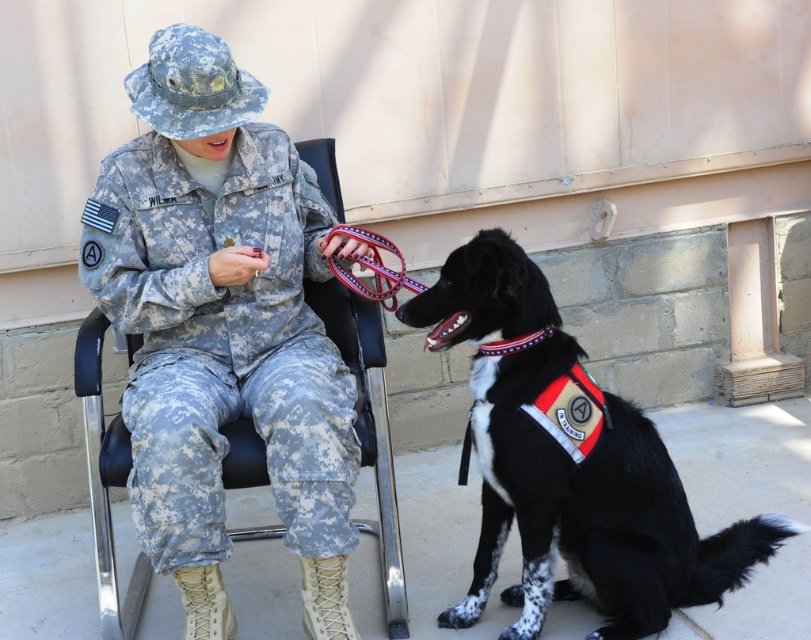
Is black/white fur vest at lower right above black leather chair at center?

Incorrect, black/white fur vest at lower right is not positioned above black leather chair at center.

Can you confirm if black/white fur vest at lower right is positioned below black leather chair at center?

Indeed, black/white fur vest at lower right is positioned under black leather chair at center.

Between point (702, 586) and point (357, 420), which one is positioned in front?

Positioned in front is point (357, 420).

The image size is (811, 640). What are the coordinates of `black/white fur vest at lower right` in the screenshot? It's located at (569, 467).